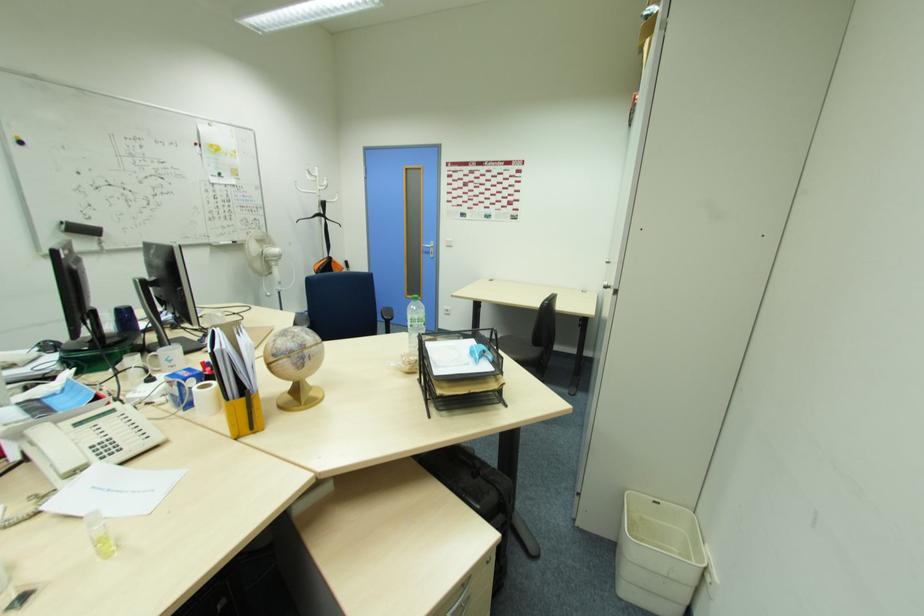
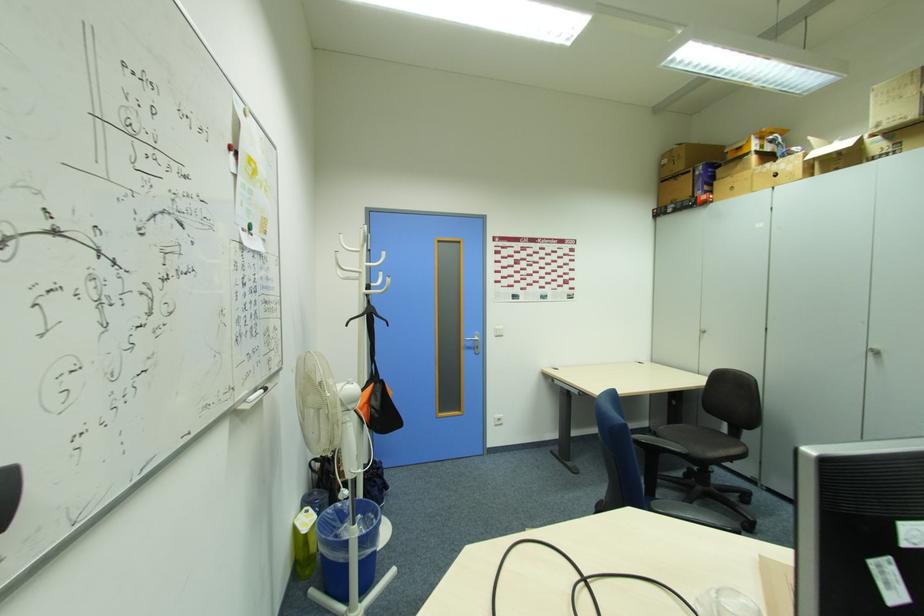
In the second image, find the point that corresponds to (x=430, y=252) in the first image.

(472, 346)